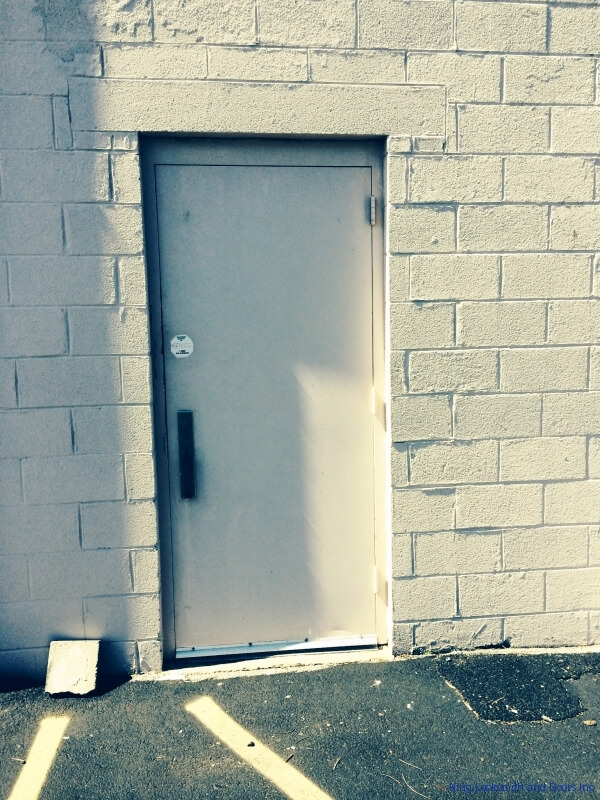
The height and width of the screenshot is (800, 600). Identify the location of bottom hinge. (372, 584).